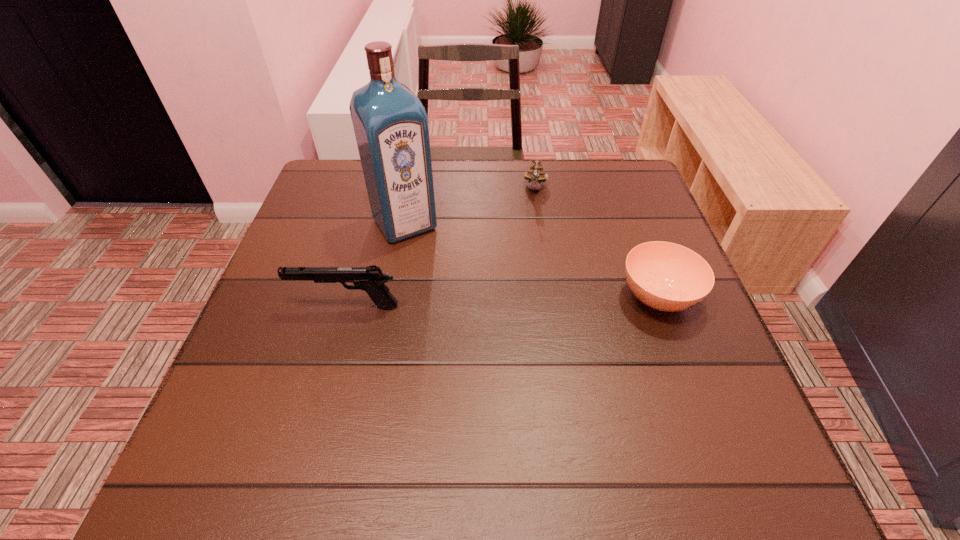
Image resolution: width=960 pixels, height=540 pixels. In the image, there is a desktop. What are the coordinates of `vacant space at the near edge` in the screenshot? It's located at (469, 416).

In the image, there is a desktop. Find the location of `vacant space at the left edge`. vacant space at the left edge is located at coordinates tap(276, 295).

You are a GUI agent. You are given a task and a screenshot of the screen. Output one action in this format:
    pyautogui.click(x=<x>, y=<y>)
    Task: Click on the free spot at the far left corner of the desktop
    The image size is (960, 540).
    Given the screenshot: What is the action you would take?
    pyautogui.click(x=348, y=192)

Where is `vacant point at the far right corner`? Image resolution: width=960 pixels, height=540 pixels. vacant point at the far right corner is located at coordinates (619, 162).

Where is `vacant region between the gun and the liquor`? vacant region between the gun and the liquor is located at coordinates (376, 265).

This screenshot has height=540, width=960. I want to click on vacant space that is in between the tallest object and the snail, so click(x=470, y=206).

The width and height of the screenshot is (960, 540). Find the location of `vacant space that's between the shortest object and the second object from right to left`. vacant space that's between the shortest object and the second object from right to left is located at coordinates (597, 243).

Where is `free area in between the third object from left to right and the liquor`? The width and height of the screenshot is (960, 540). free area in between the third object from left to right and the liquor is located at coordinates (470, 206).

I want to click on free space between the shortest object and the second farthest object, so click(531, 260).

Locate an element on the screen. unoccupied position between the third nearest object and the third object from left to right is located at coordinates (470, 206).